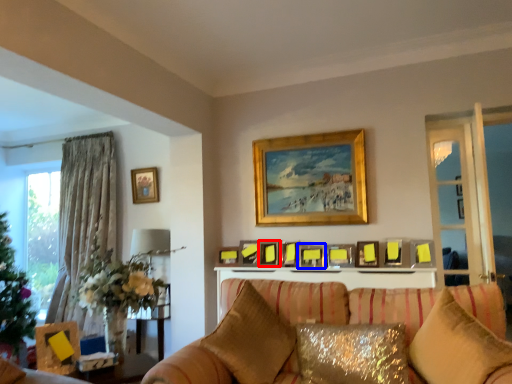
Question: Which object appears closest to the camera in this image, picture frame (highlighted by a red box) or picture frame (highlighted by a blue box)?

Choices:
 (A) picture frame
 (B) picture frame

Answer: (B)